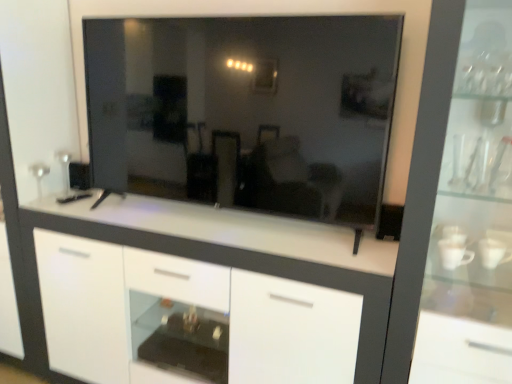
Question: Is the depth of transparent glass cabinet at right greater than that of white glossy cabinet at center?

Choices:
 (A) yes
 (B) no

Answer: (B)

Question: From a real-world perspective, is transparent glass cabinet at right positioned under white glossy cabinet at center based on gravity?

Choices:
 (A) no
 (B) yes

Answer: (A)

Question: Is transparent glass cabinet at right smaller than white glossy cabinet at center?

Choices:
 (A) no
 (B) yes

Answer: (B)

Question: Could white glossy cabinet at center be considered to be inside transparent glass cabinet at right?

Choices:
 (A) no
 (B) yes

Answer: (A)

Question: Can you confirm if transparent glass cabinet at right is positioned to the left of white glossy cabinet at center?

Choices:
 (A) yes
 (B) no

Answer: (B)

Question: Is transparent glass cabinet at right next to white glossy cabinet at center?

Choices:
 (A) no
 (B) yes

Answer: (A)

Question: Does transparent glass mirror at center have a larger size compared to transparent glass cabinet at right?

Choices:
 (A) no
 (B) yes

Answer: (A)

Question: Is transparent glass mirror at center far from transparent glass cabinet at right?

Choices:
 (A) no
 (B) yes

Answer: (A)

Question: Can you confirm if transparent glass mirror at center is shorter than transparent glass cabinet at right?

Choices:
 (A) no
 (B) yes

Answer: (B)

Question: From a real-world perspective, is transparent glass mirror at center below transparent glass cabinet at right?

Choices:
 (A) yes
 (B) no

Answer: (B)

Question: Does transparent glass mirror at center have a greater width compared to transparent glass cabinet at right?

Choices:
 (A) yes
 (B) no

Answer: (B)

Question: Is transparent glass cabinet at right surrounded by transparent glass mirror at center?

Choices:
 (A) yes
 (B) no

Answer: (B)

Question: Considering the relative positions of transparent glass cabinet at right and transparent glass mirror at center in the image provided, is transparent glass cabinet at right to the left of transparent glass mirror at center from the viewer's perspective?

Choices:
 (A) no
 (B) yes

Answer: (A)